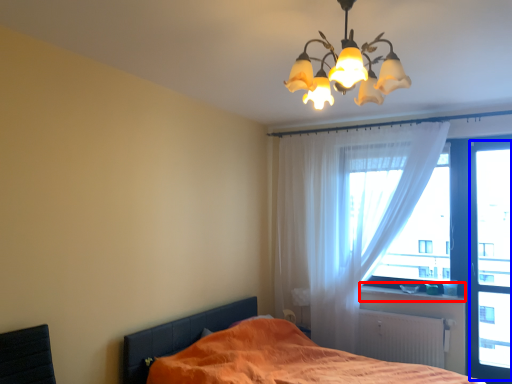
Question: Which of the following is the farthest to the observer, window sill (highlighted by a red box) or window screen (highlighted by a blue box)?

Choices:
 (A) window sill
 (B) window screen

Answer: (A)